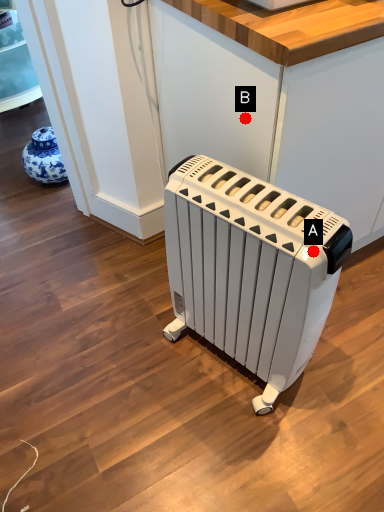
Question: Two points are circled on the image, labeled by A and B beside each circle. Which point appears closest to the camera in this image?

Choices:
 (A) A is closer
 (B) B is closer

Answer: (A)